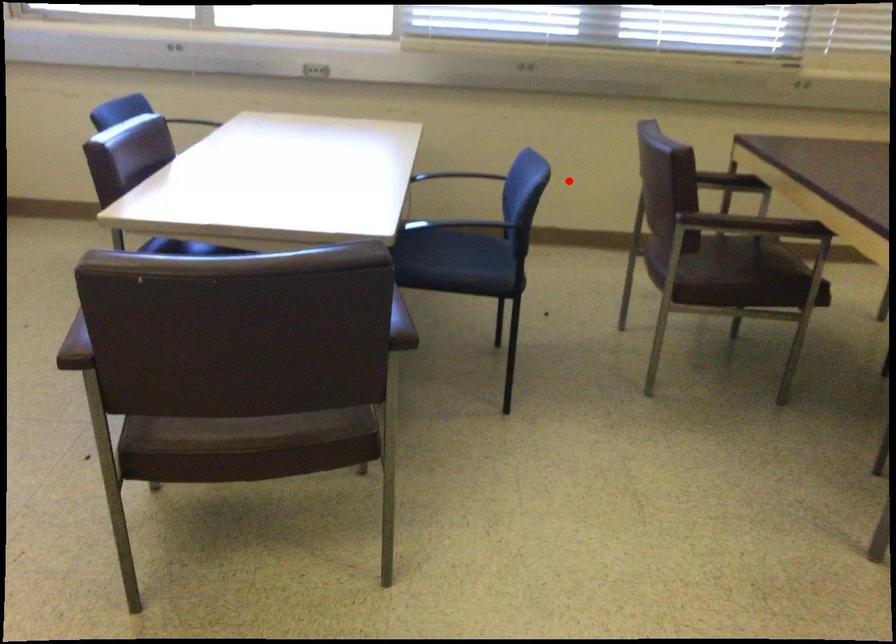
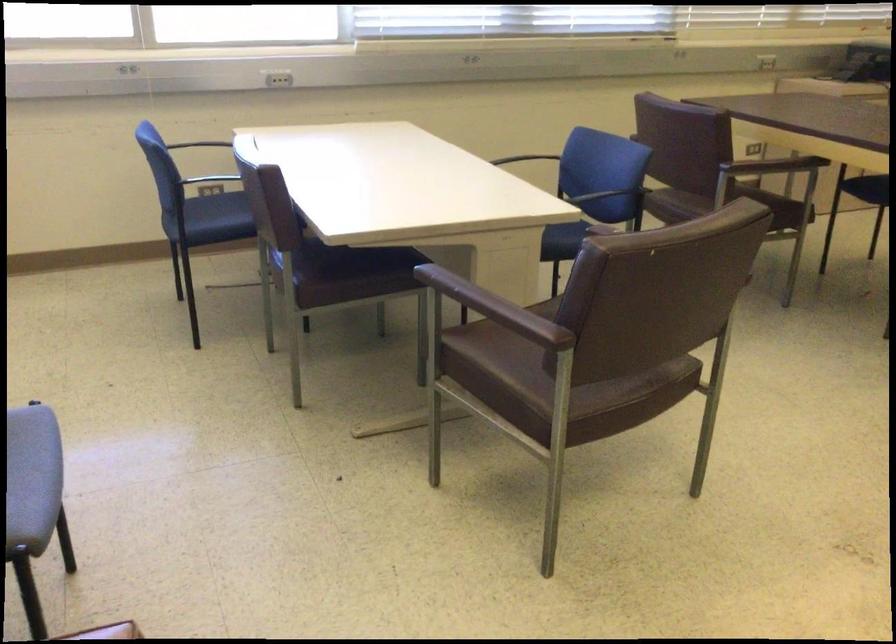
Find the pixel in the second image that matches the highlighted location in the first image.

(521, 158)